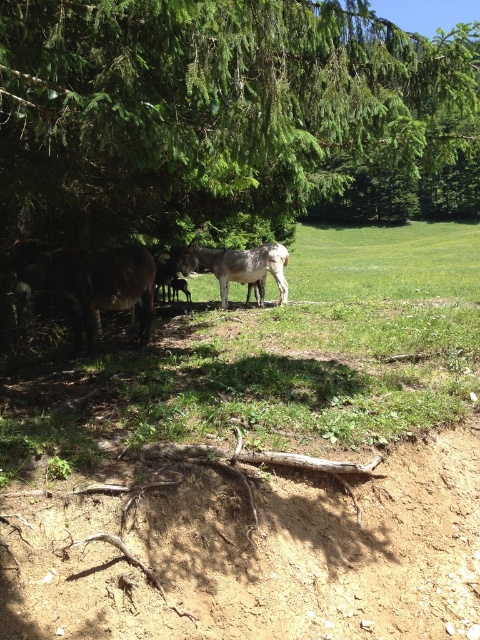
You are planning to set up a small tent for shade in the area shown. The tent requires a clear space of 10 feet between the green leafy tree at center and the green grassy at lower center. Based on the scene description, will there be enough space?

The green leafy tree at center and green grassy at lower center are 8.34 feet apart, which is less than the required 10 feet. Therefore, there isn not enough space to set up the tent between them.

Looking at this image, you are planning to set up a picnic blanket in the lower center area where the green grassy at lower center is located. Considering the size of the gray matte donkey at center, will there be enough space for both the donkey and the picnic blanket?

The green grassy at lower center has a larger width than the gray matte donkey at center, so there should be enough space to accommodate both the picnic blanket and the donkey without overcrowding the area.

You are a photographer trying to capture a photo of both the brown fuzzy donkey at left and the gray matte donkey at center. Based on their positions, which donkey should you focus on first to ensure both are in frame?

The brown fuzzy donkey at left is positioned on the left side of the gray matte donkey at center, so you should focus on the gray matte donkey at center first to ensure both are in frame.